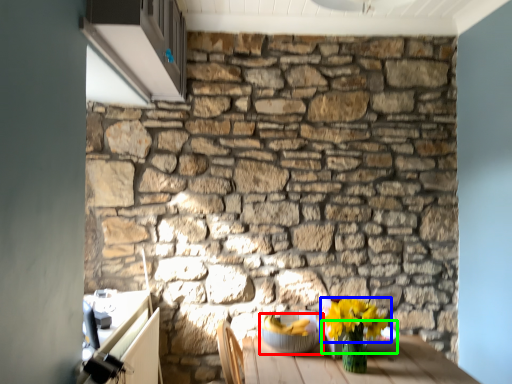
Question: Which is nearer to the glass bowl (highlighted by a red box)? flower (highlighted by a blue box) or glass bowl (highlighted by a green box).

Choices:
 (A) flower
 (B) glass bowl

Answer: (B)